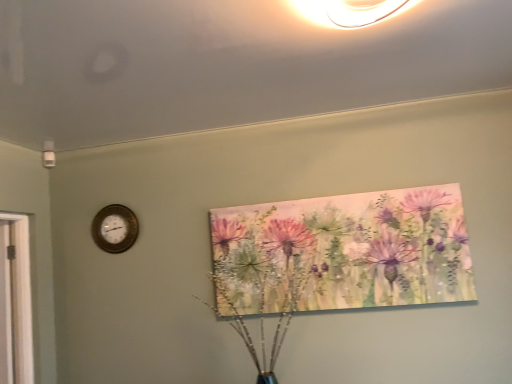
Question: From the image's perspective, is wooden clock at left located above or below watercolor painting at upper center?

Choices:
 (A) above
 (B) below

Answer: (A)

Question: Looking at their shapes, would you say wooden clock at left is wider or thinner than watercolor painting at upper center?

Choices:
 (A) thin
 (B) wide

Answer: (A)

Question: Considering the relative positions of wooden clock at left and watercolor painting at upper center in the image provided, is wooden clock at left to the left or to the right of watercolor painting at upper center?

Choices:
 (A) left
 (B) right

Answer: (A)

Question: From the image's perspective, is watercolor painting at upper center above or below wooden clock at left?

Choices:
 (A) below
 (B) above

Answer: (A)

Question: Is point (449, 253) closer or farther from the camera than point (111, 210)?

Choices:
 (A) farther
 (B) closer

Answer: (B)

Question: From a real-world perspective, relative to wooden clock at left, is watercolor painting at upper center vertically above or below?

Choices:
 (A) above
 (B) below

Answer: (B)

Question: From their relative heights in the image, would you say watercolor painting at upper center is taller or shorter than wooden clock at left?

Choices:
 (A) tall
 (B) short

Answer: (A)